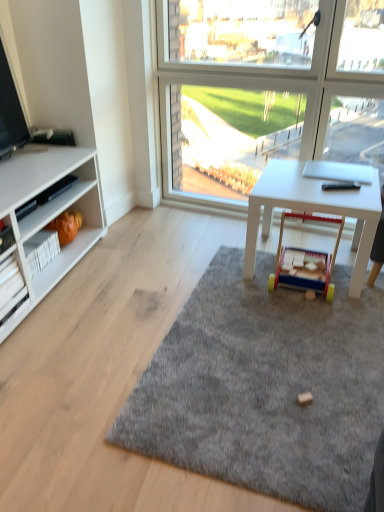
Locate an element on the screen. spots to the right of white cardboard shelf at left is located at coordinates (40, 316).